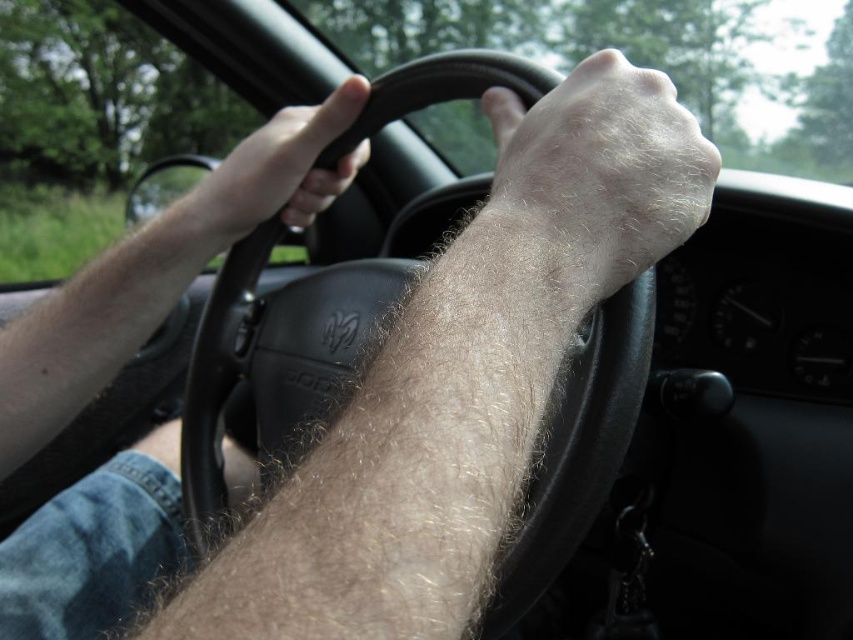
Between hair-covered skin at center and matte black steering wheel at left, which one has more height?

Standing taller between the two is hair-covered skin at center.

Between hair-covered skin at center and matte black steering wheel at left, which one appears on the left side from the viewer's perspective?

Positioned to the left is matte black steering wheel at left.

The width and height of the screenshot is (853, 640). Describe the element at coordinates (590, 180) in the screenshot. I see `hair-covered skin at center` at that location.

In order to click on hair-covered skin at center in this screenshot , I will do `click(590, 180)`.